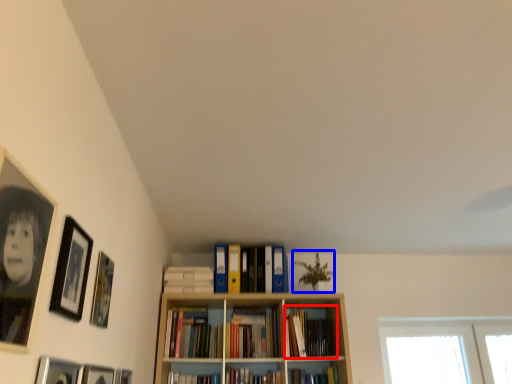
Question: Among these objects, which one is farthest to the camera, book (highlighted by a red box) or plant (highlighted by a blue box)?

Choices:
 (A) book
 (B) plant

Answer: (B)